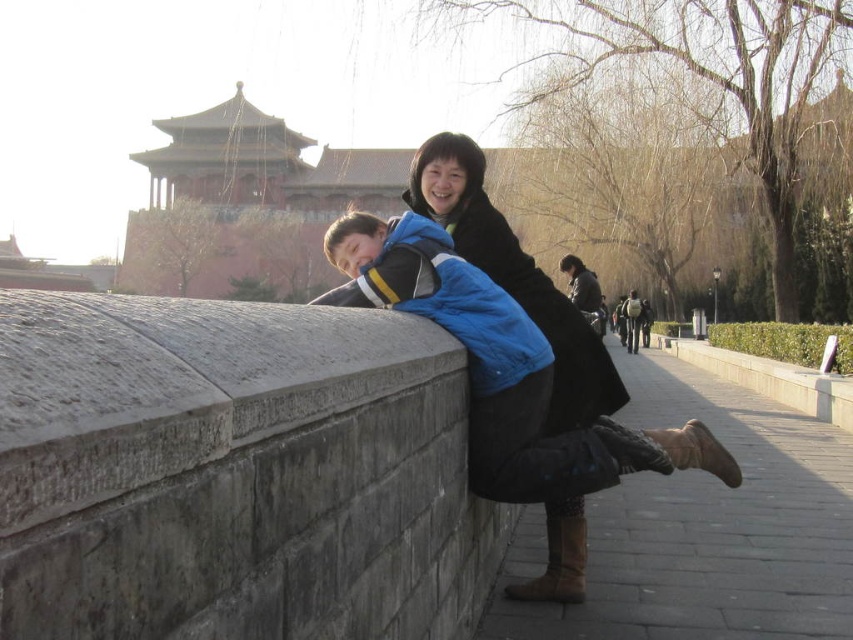
Which is behind, point (570, 378) or point (701, 432)?

Point (570, 378)

Does point (500, 246) come behind point (735, 461)?

No.

You are a GUI agent. You are given a task and a screenshot of the screen. Output one action in this format:
    pyautogui.click(x=<x>, y=<y>)
    Task: Click on the matte blue jacket at center
    The width and height of the screenshot is (853, 640).
    Given the screenshot: What is the action you would take?
    pyautogui.click(x=521, y=288)

Is matte blue jacket at center shorter than brown suede boot at lower center?

Incorrect, matte blue jacket at center's height does not fall short of brown suede boot at lower center's.

Who is more forward, (428, 193) or (566, 556)?

Point (566, 556) is in front.

Locate an element on the screen. matte blue jacket at center is located at coordinates (521, 288).

Where is `brown suede boot at lower center`? The height and width of the screenshot is (640, 853). brown suede boot at lower center is located at coordinates (558, 563).

What are the coordinates of `brown suede boot at lower center` in the screenshot? It's located at (558, 563).

You are a GUI agent. You are given a task and a screenshot of the screen. Output one action in this format:
    pyautogui.click(x=<x>, y=<y>)
    Task: Click on the brown suede boot at lower center
    
    Given the screenshot: What is the action you would take?
    pyautogui.click(x=558, y=563)